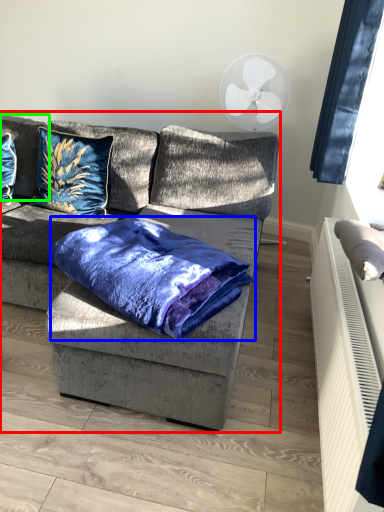
Question: Considering the real-world distances, which object is farthest from studio couch (highlighted by a red box)? cloth (highlighted by a blue box) or pillow (highlighted by a green box)?

Choices:
 (A) cloth
 (B) pillow

Answer: (B)